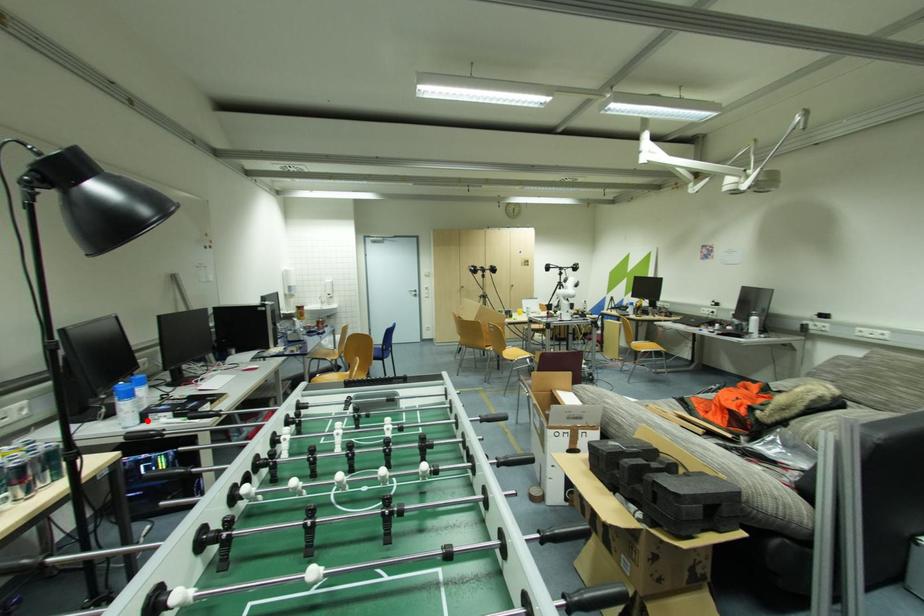
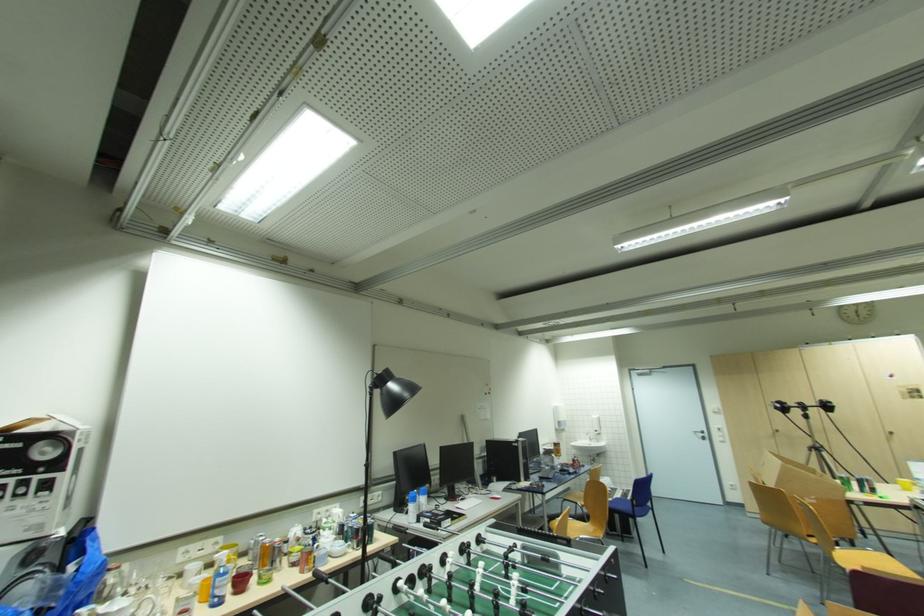
Find the pixel in the second image that matches the highlighted location in the first image.

(420, 522)